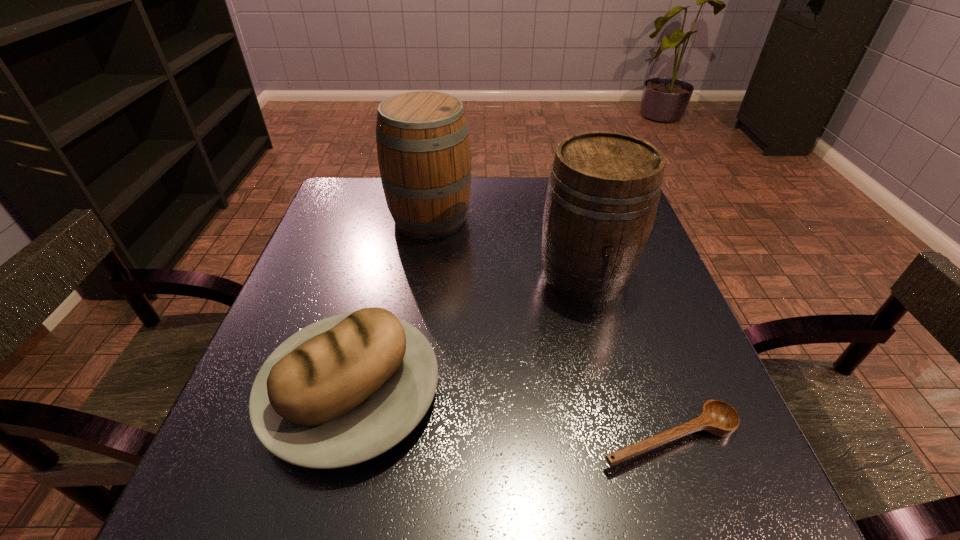
Where is `vacant space in between the nearer cider and the wooden spoon`? vacant space in between the nearer cider and the wooden spoon is located at coordinates (627, 356).

Locate an element on the screen. free area in between the farther cider and the bread is located at coordinates (391, 305).

Find the location of a particular element. The width and height of the screenshot is (960, 540). vacant area that lies between the third tallest object and the wooden spoon is located at coordinates point(510,415).

Find the location of a particular element. Image resolution: width=960 pixels, height=540 pixels. vacant area that lies between the third nearest object and the left cider is located at coordinates (508, 246).

Where is `object that ranks as the closest to the farther cider`? object that ranks as the closest to the farther cider is located at coordinates (603, 191).

At what (x,y) coordinates should I click in order to perform the action: click on the closest object to the left cider. Please return your answer as a coordinate pair (x, y). The height and width of the screenshot is (540, 960). Looking at the image, I should click on point(603,191).

You are a GUI agent. You are given a task and a screenshot of the screen. Output one action in this format:
    pyautogui.click(x=<x>, y=<y>)
    Task: Click on the vacant space that satisfies the following two spatial constraints: 1. on the side of the nearer cider near the bung hole; 2. on the left side of the wooden spoon
    The width and height of the screenshot is (960, 540).
    Given the screenshot: What is the action you would take?
    pyautogui.click(x=629, y=438)

Where is `vacant area that satisfies the following two spatial constraints: 1. on the side of the third nearest object near the bung hole; 2. on the left side of the shortest object`? Image resolution: width=960 pixels, height=540 pixels. vacant area that satisfies the following two spatial constraints: 1. on the side of the third nearest object near the bung hole; 2. on the left side of the shortest object is located at coordinates (629, 438).

Locate an element on the screen. The height and width of the screenshot is (540, 960). free space in the image that satisfies the following two spatial constraints: 1. on the side of the third nearest object near the bung hole; 2. on the left side of the shortest object is located at coordinates (629, 438).

Identify the location of vacant space that satisfies the following two spatial constraints: 1. on the side of the wooden spoon near the bung hole; 2. on the right side of the nearer cider. The image size is (960, 540). (629, 438).